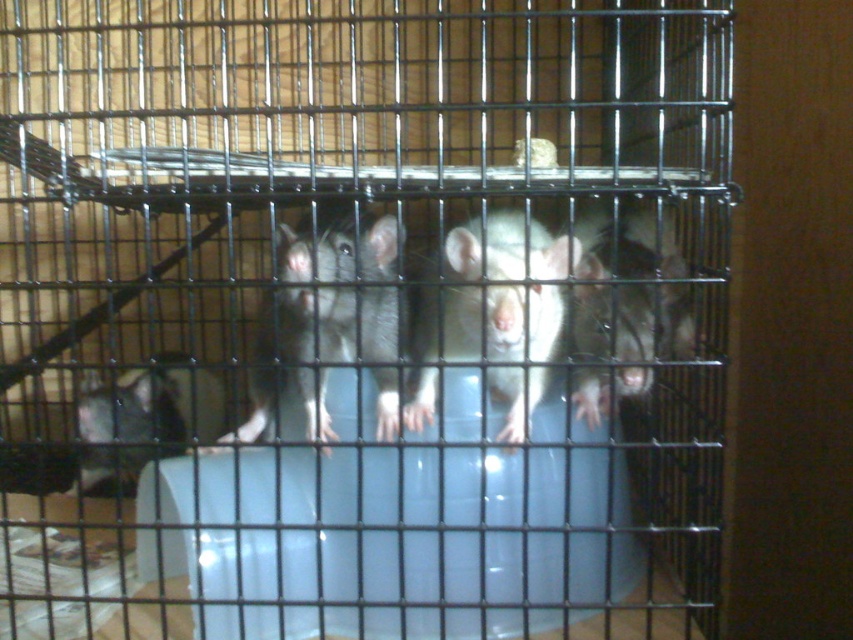
Question: Is gray matte rat at center further to camera compared to matte gray mouse at lower left?

Choices:
 (A) no
 (B) yes

Answer: (B)

Question: Is white matte mouse at center wider than matte gray mouse at lower left?

Choices:
 (A) yes
 (B) no

Answer: (B)

Question: Which point is closer to the camera taking this photo?

Choices:
 (A) (329, 276)
 (B) (134, 374)
 (C) (521, 362)

Answer: (C)

Question: Can you confirm if gray matte rat at center is positioned to the right of matte gray mouse at lower left?

Choices:
 (A) yes
 (B) no

Answer: (A)

Question: Which of the following is the closest to the observer?

Choices:
 (A) white matte rat at center
 (B) matte gray mouse at lower left
 (C) white matte mouse at center
 (D) gray matte rat at center

Answer: (B)

Question: Among these points, which one is nearest to the camera?

Choices:
 (A) (88, 445)
 (B) (282, 275)

Answer: (B)